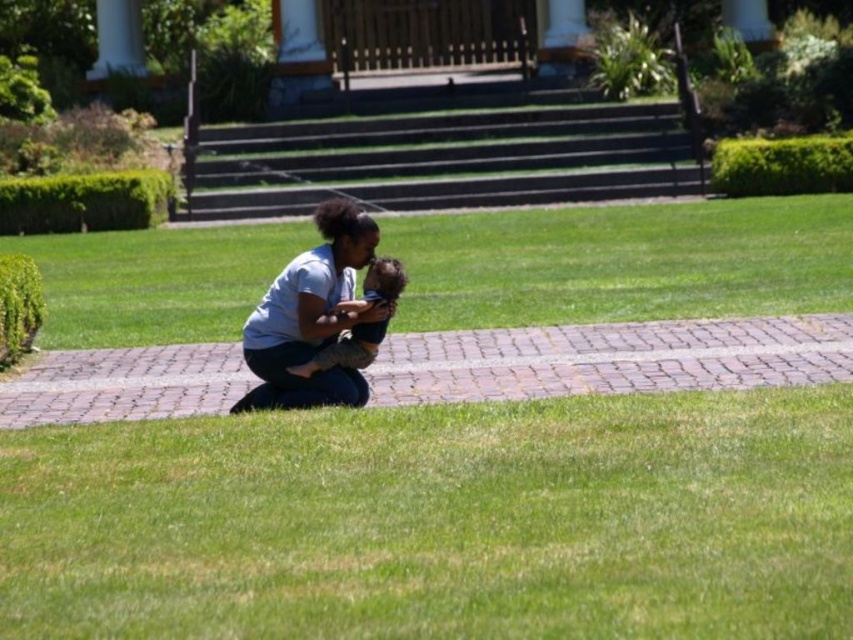
You are a gardener who needs to mow the lawn. You see the green grass at center and the light blue cotton shirt at center. Which object is taller and requires more attention for trimming?

The green grass at center is much taller than the light blue cotton shirt at center, so it requires more attention for trimming.

You are standing at the edge of the grassy area and want to walk to the woman and child on the brick pathway. Which direction should you move to avoid stepping on the green grass at lower center?

The green grass at lower center is located at point [439,522]. To avoid stepping on it, you should move towards the brick pathway, which is in the middle of the frame, rather than towards the lower center where the grass is located.